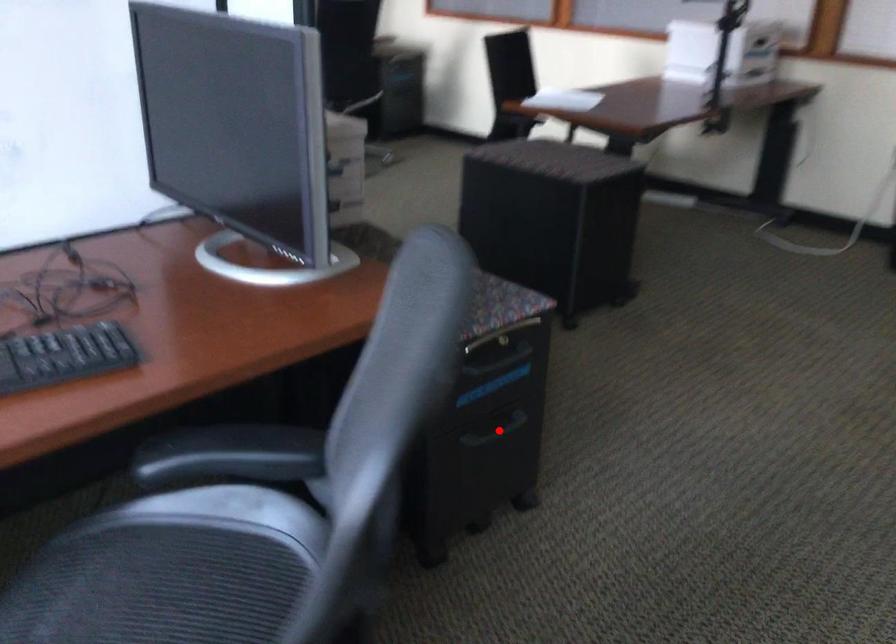
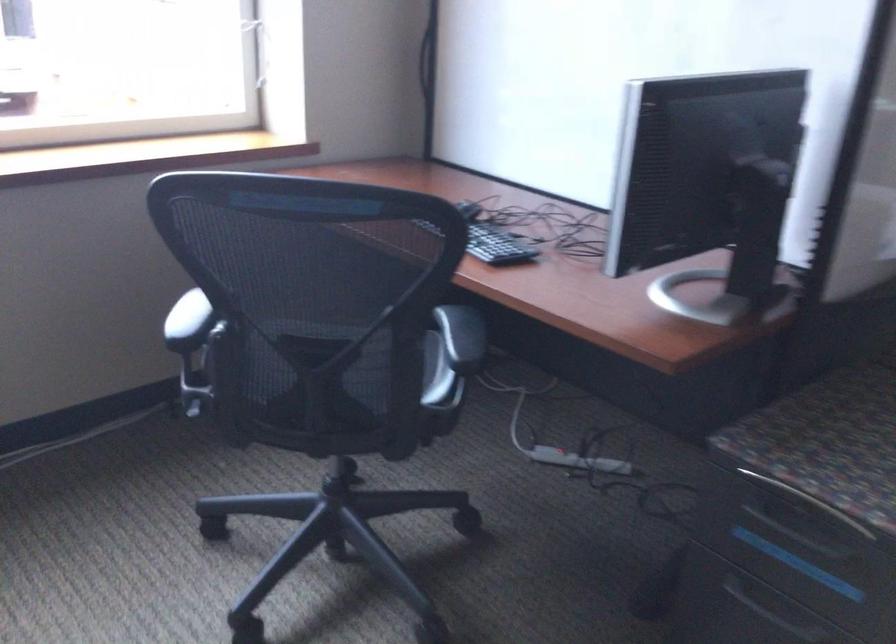
Where in the second image is the point corresponding to the highlighted location from the first image?

(778, 614)